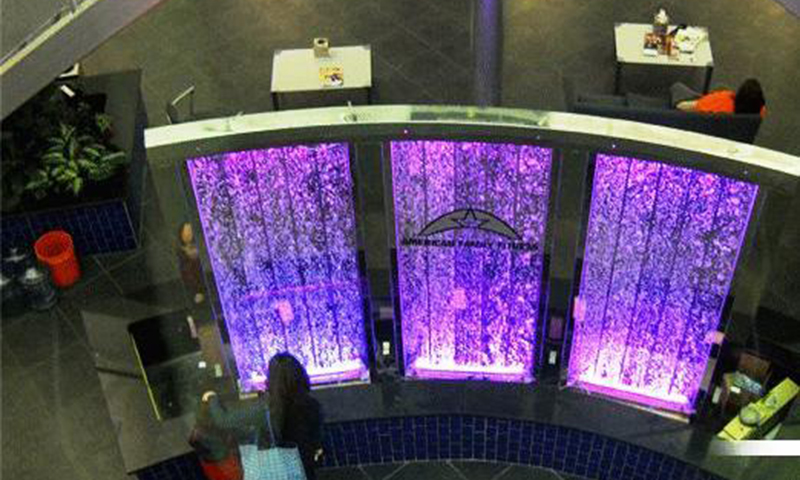
At what (x,y) coordinates should I click in order to perform the action: click on bucket. Please return your answer as a coordinate pair (x, y). The image size is (800, 480). Looking at the image, I should click on (57, 251).